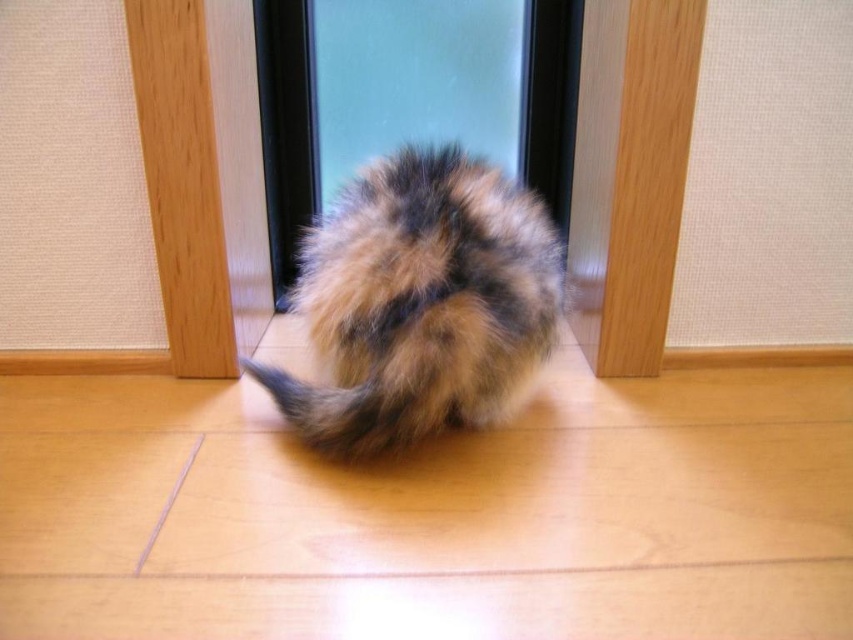
Question: Does transparent glass door at center have a larger size compared to fuzzy fur tail at center?

Choices:
 (A) yes
 (B) no

Answer: (A)

Question: Which object is the farthest from the transparent glass door at center?

Choices:
 (A) fluffy fur cat at center
 (B) fuzzy fur tail at center

Answer: (B)

Question: Which point appears farthest from the camera in this image?

Choices:
 (A) (350, 444)
 (B) (373, 173)

Answer: (B)

Question: Which object is the farthest from the fuzzy fur tail at center?

Choices:
 (A) transparent glass door at center
 (B) fluffy fur cat at center

Answer: (A)

Question: Where is fluffy fur cat at center located in relation to transparent glass door at center in the image?

Choices:
 (A) right
 (B) left

Answer: (B)

Question: Can you confirm if fluffy fur cat at center is positioned above fuzzy fur tail at center?

Choices:
 (A) yes
 (B) no

Answer: (A)